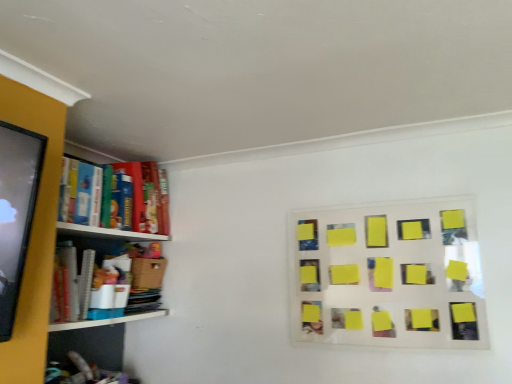
Question: Considering the positions of point (131, 228) and point (323, 334), is point (131, 228) closer or farther from the camera than point (323, 334)?

Choices:
 (A) closer
 (B) farther

Answer: (B)

Question: Would you say matte cardboard bookshelf at left is inside or outside yellow sticky notes at upper right?

Choices:
 (A) inside
 (B) outside

Answer: (B)

Question: From the image's perspective, is matte cardboard bookshelf at left located above or below yellow sticky notes at upper right?

Choices:
 (A) above
 (B) below

Answer: (A)

Question: Considering the positions of yellow sticky notes at upper right and matte cardboard bookshelf at left in the image, is yellow sticky notes at upper right bigger or smaller than matte cardboard bookshelf at left?

Choices:
 (A) big
 (B) small

Answer: (B)

Question: Visually, is yellow sticky notes at upper right positioned to the left or to the right of matte cardboard bookshelf at left?

Choices:
 (A) right
 (B) left

Answer: (A)

Question: In terms of height, does yellow sticky notes at upper right look taller or shorter compared to matte cardboard bookshelf at left?

Choices:
 (A) tall
 (B) short

Answer: (A)

Question: From the image's perspective, is yellow sticky notes at upper right located above or below matte cardboard bookshelf at left?

Choices:
 (A) below
 (B) above

Answer: (A)